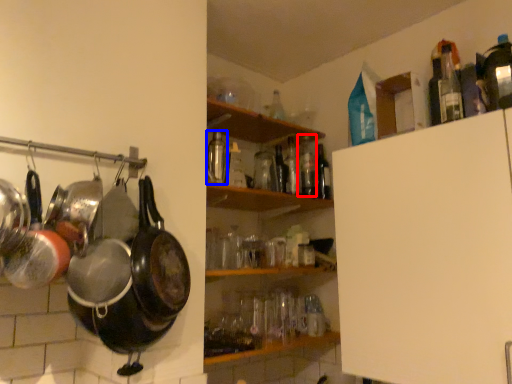
Question: Which object appears closest to the camera in this image, bottle (highlighted by a red box) or bottle (highlighted by a blue box)?

Choices:
 (A) bottle
 (B) bottle

Answer: (B)